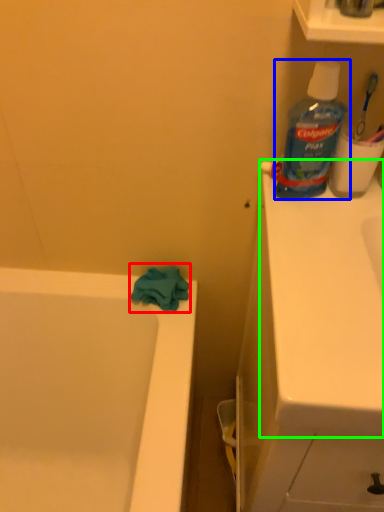
Question: Which is nearer to the bath towel (highlighted by a red box)? bottle (highlighted by a blue box) or counter top (highlighted by a green box).

Choices:
 (A) bottle
 (B) counter top

Answer: (A)